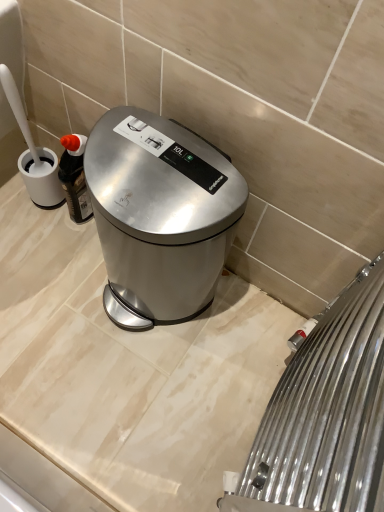
Locate an element on the screen. The height and width of the screenshot is (512, 384). satin silver trash can at center is located at coordinates (160, 215).

Image resolution: width=384 pixels, height=512 pixels. What do you see at coordinates (160, 215) in the screenshot?
I see `satin silver trash can at center` at bounding box center [160, 215].

Measure the distance between satin nickel radiator at lower right and camera.

A distance of 10.77 inches exists between satin nickel radiator at lower right and camera.

Image resolution: width=384 pixels, height=512 pixels. What do you see at coordinates (324, 414) in the screenshot? I see `satin nickel radiator at lower right` at bounding box center [324, 414].

Where is `satin nickel radiator at lower right`? The width and height of the screenshot is (384, 512). satin nickel radiator at lower right is located at coordinates (324, 414).

The width and height of the screenshot is (384, 512). Find the location of `satin silver trash can at center`. satin silver trash can at center is located at coordinates (160, 215).

Does satin silver trash can at center appear on the left side of satin nickel radiator at lower right?

Correct, you'll find satin silver trash can at center to the left of satin nickel radiator at lower right.

Relative to satin nickel radiator at lower right, is satin silver trash can at center in front or behind?

satin silver trash can at center is behind satin nickel radiator at lower right.

Which is closer to the camera, (168,207) or (287,455)?

Point (168,207) appears to be farther away from the viewer than point (287,455).

From the image's perspective, is satin silver trash can at center located beneath satin nickel radiator at lower right?

Incorrect, from the image's perspective, satin silver trash can at center is higher than satin nickel radiator at lower right.

From a real-world perspective, which is physically below, satin silver trash can at center or satin nickel radiator at lower right?

In real-world perspective, satin silver trash can at center is lower.

Does satin silver trash can at center have a lesser width compared to satin nickel radiator at lower right?

In fact, satin silver trash can at center might be wider than satin nickel radiator at lower right.

Which of these two, satin silver trash can at center or satin nickel radiator at lower right, stands taller?

Standing taller between the two is satin nickel radiator at lower right.

In the scene shown: Considering the sizes of objects satin silver trash can at center and satin nickel radiator at lower right in the image provided, who is smaller, satin silver trash can at center or satin nickel radiator at lower right?

With smaller size is satin nickel radiator at lower right.

Is satin silver trash can at center inside the boundaries of satin nickel radiator at lower right, or outside?

satin silver trash can at center lies outside satin nickel radiator at lower right.

Is there a large distance between satin silver trash can at center and satin nickel radiator at lower right?

satin silver trash can at center is near satin nickel radiator at lower right, not far away.

Is satin silver trash can at center oriented away from satin nickel radiator at lower right?

No, satin silver trash can at center's orientation is not away from satin nickel radiator at lower right.

How different are the orientations of satin silver trash can at center and satin nickel radiator at lower right in degrees?

The angle between the facing direction of satin silver trash can at center and the facing direction of satin nickel radiator at lower right is 90.3 degrees.

How far apart are satin silver trash can at center and satin nickel radiator at lower right?

satin silver trash can at center is 11.95 inches from satin nickel radiator at lower right.

This screenshot has width=384, height=512. I want to click on home appliance on the right of satin silver trash can at center, so click(x=324, y=414).

From the picture: Considering the relative positions of satin nickel radiator at lower right and satin silver trash can at center in the image provided, is satin nickel radiator at lower right to the right of satin silver trash can at center from the viewer's perspective?

Yes, satin nickel radiator at lower right is to the right of satin silver trash can at center.

In the image, is satin nickel radiator at lower right positioned in front of or behind satin silver trash can at center?

satin nickel radiator at lower right is positioned closer to the viewer than satin silver trash can at center.

Does point (227, 477) come behind point (172, 271)?

No, it is in front of (172, 271).

From the image's perspective, which is above, satin nickel radiator at lower right or satin silver trash can at center?

From the image's view, satin silver trash can at center is above.

From a real-world perspective, which is physically below, satin nickel radiator at lower right or satin silver trash can at center?

satin silver trash can at center, from a real-world perspective.

In terms of width, does satin nickel radiator at lower right look wider or thinner when compared to satin silver trash can at center?

Considering their sizes, satin nickel radiator at lower right looks slimmer than satin silver trash can at center.

Does satin nickel radiator at lower right have a greater height compared to satin silver trash can at center?

Yes, satin nickel radiator at lower right is taller than satin silver trash can at center.

Considering the sizes of objects satin nickel radiator at lower right and satin silver trash can at center in the image provided, who is bigger, satin nickel radiator at lower right or satin silver trash can at center?

satin silver trash can at center.

Is satin silver trash can at center a part of satin nickel radiator at lower right?

No.

Would you say satin nickel radiator at lower right is a long distance from satin silver trash can at center?

That's not correct — satin nickel radiator at lower right is a little close to satin silver trash can at center.

Is satin nickel radiator at lower right oriented towards satin silver trash can at center?

Yes, satin nickel radiator at lower right is oriented towards satin silver trash can at center.

I want to click on kitchen appliance lying on the left of satin nickel radiator at lower right, so click(x=160, y=215).

Where is `kitchen appliance lying above the satin nickel radiator at lower right (from the image's perspective)`? Image resolution: width=384 pixels, height=512 pixels. kitchen appliance lying above the satin nickel radiator at lower right (from the image's perspective) is located at coordinates (160, 215).

Find the location of `home appliance located on the right of satin silver trash can at center`. home appliance located on the right of satin silver trash can at center is located at coordinates (324, 414).